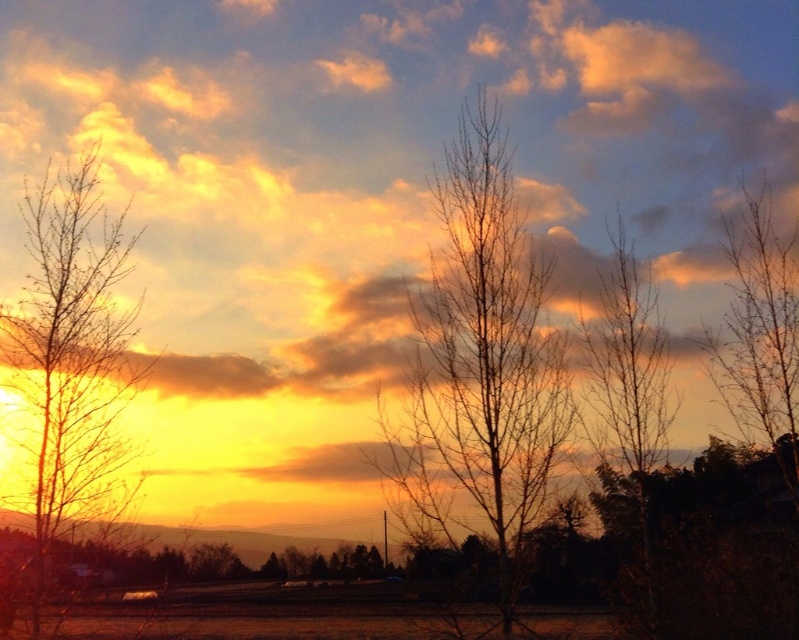
Is golden/yellow cloud at upper center wider than bare branches at left?

Yes, golden/yellow cloud at upper center is wider than bare branches at left.

What do you see at coordinates (384, 145) in the screenshot? This screenshot has width=799, height=640. I see `golden/yellow cloud at upper center` at bounding box center [384, 145].

Locate an element on the screen. The height and width of the screenshot is (640, 799). golden/yellow cloud at upper center is located at coordinates (384, 145).

Can you confirm if golden/yellow cloud at upper center is thinner than bare branches at upper right?

In fact, golden/yellow cloud at upper center might be wider than bare branches at upper right.

How much distance is there between golden/yellow cloud at upper center and bare branches at upper right?

golden/yellow cloud at upper center is 2.84 meters from bare branches at upper right.

Which is in front, point (646, 244) or point (585, 404)?

Point (585, 404) is in front.

Find the location of a particular element. golden/yellow cloud at upper center is located at coordinates (384, 145).

This screenshot has width=799, height=640. Describe the element at coordinates (479, 365) in the screenshot. I see `bare branches at center` at that location.

You are a GUI agent. You are given a task and a screenshot of the screen. Output one action in this format:
    pyautogui.click(x=<x>, y=<y>)
    Task: Click on the bare branches at center
    The image size is (799, 640).
    Given the screenshot: What is the action you would take?
    pyautogui.click(x=479, y=365)